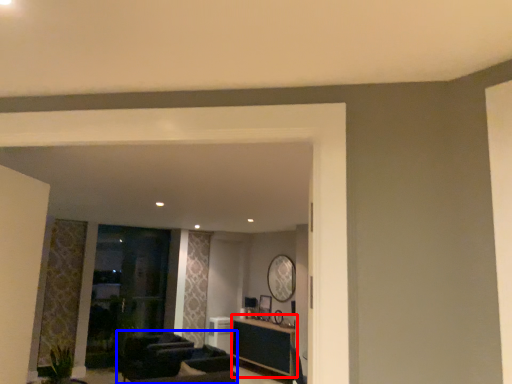
Question: Which of the following is the closest to the observer, table (highlighted by a red box) or armchair (highlighted by a blue box)?

Choices:
 (A) table
 (B) armchair

Answer: (B)